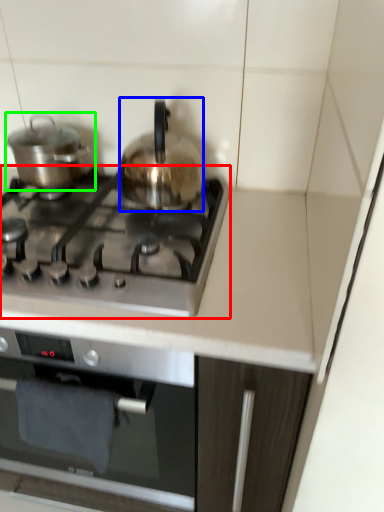
Question: Based on their relative distances, which object is nearer to gas stove (highlighted by a red box)? Choose from kitchen appliance (highlighted by a blue box) and kitchen appliance (highlighted by a green box).

Choices:
 (A) kitchen appliance
 (B) kitchen appliance

Answer: (A)